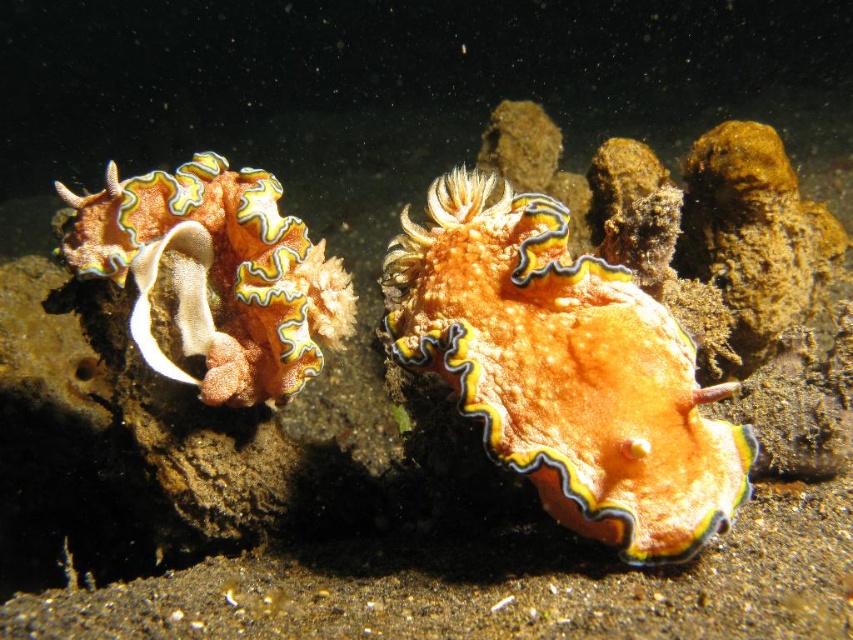
Between orange matte sea slug at center and orange matte coral at left, which one appears on the right side from the viewer's perspective?

From the viewer's perspective, orange matte sea slug at center appears more on the right side.

Can you confirm if orange matte sea slug at center is shorter than orange matte coral at left?

No, orange matte sea slug at center is not shorter than orange matte coral at left.

This screenshot has width=853, height=640. In order to click on orange matte sea slug at center in this screenshot , I will do [564, 369].